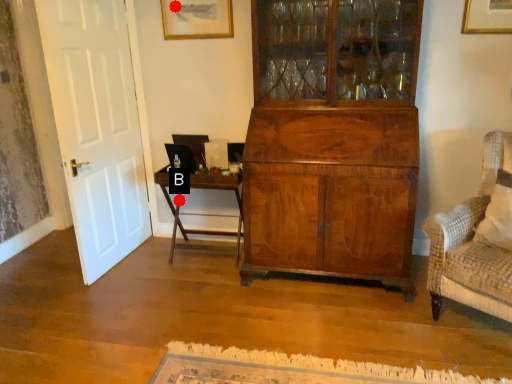
Question: Two points are circled on the image, labeled by A and B beside each circle. Which of the following is the closest to the observer?

Choices:
 (A) A is closer
 (B) B is closer

Answer: (A)